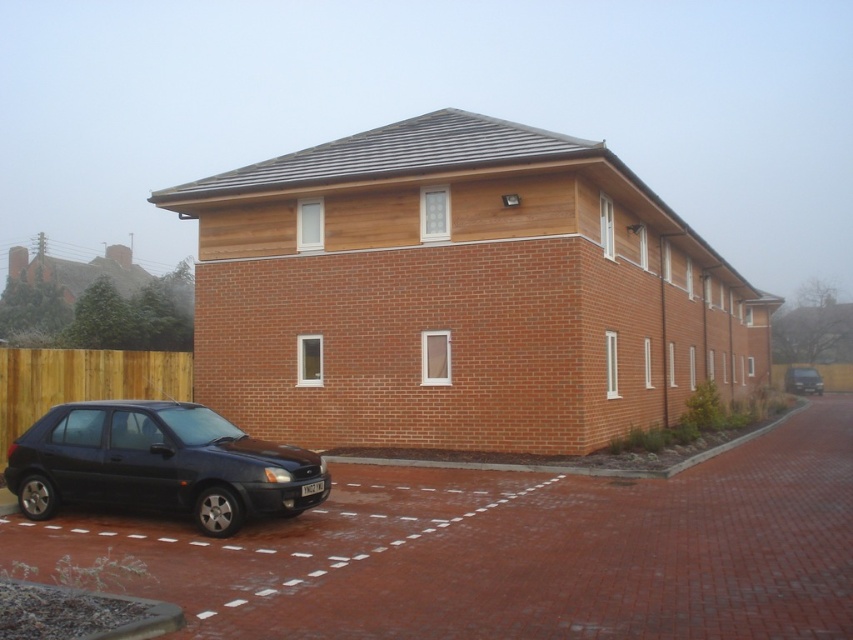
Question: Considering the real-world distances, which object is closest to the matte black suv at right?

Choices:
 (A) matte black car at lower left
 (B) brick at lower left

Answer: (B)

Question: Among these points, which one is farthest from the camera?

Choices:
 (A) (210, 451)
 (B) (798, 384)

Answer: (B)

Question: Which object is positioned closest to the brick at lower left?

Choices:
 (A) matte black car at lower left
 (B) matte black suv at right

Answer: (A)

Question: Is matte black car at lower left wider than matte black suv at right?

Choices:
 (A) yes
 (B) no

Answer: (A)

Question: Is brick at lower left to the right of matte black car at lower left from the viewer's perspective?

Choices:
 (A) yes
 (B) no

Answer: (A)

Question: Is matte black car at lower left smaller than matte black suv at right?

Choices:
 (A) yes
 (B) no

Answer: (B)